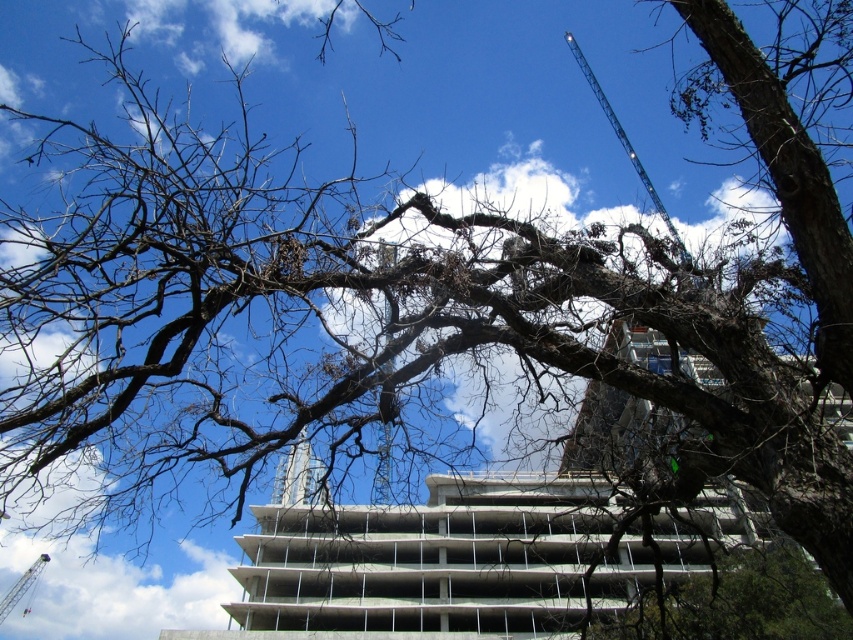
Question: Which object appears farthest from the camera in this image?

Choices:
 (A) metallic blue crane at lower left
 (B) white concrete tower at center

Answer: (A)

Question: Is white concrete tower at center bigger than blue metallic crane at upper center?

Choices:
 (A) yes
 (B) no

Answer: (B)

Question: Which object is positioned closest to the blue metallic crane at upper center?

Choices:
 (A) white concrete tower at center
 (B) metallic blue crane at lower left

Answer: (A)

Question: Does white concrete tower at center lie behind blue metallic crane at upper center?

Choices:
 (A) yes
 (B) no

Answer: (A)

Question: Which object is farther from the camera taking this photo?

Choices:
 (A) white concrete tower at center
 (B) blue metallic crane at upper center
 (C) metallic blue crane at lower left

Answer: (C)

Question: Does blue metallic crane at upper center have a lesser width compared to metallic blue crane at lower left?

Choices:
 (A) yes
 (B) no

Answer: (B)